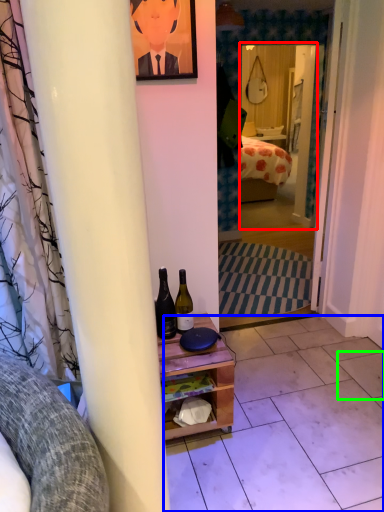
Question: Considering the real-world distances, which object is farthest from mirror (highlighted by a red box)? tile (highlighted by a blue box) or tile (highlighted by a green box)?

Choices:
 (A) tile
 (B) tile

Answer: (B)